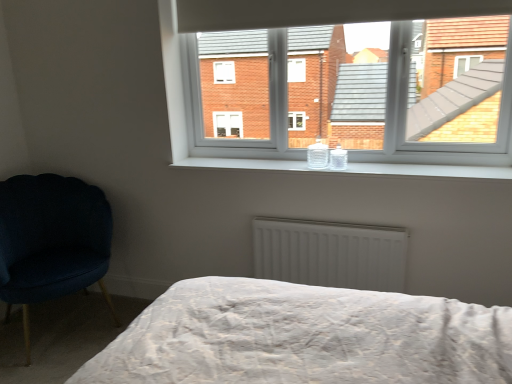
Question: Is white plastic window at upper center outside velvet dark blue chair at left?

Choices:
 (A) no
 (B) yes

Answer: (B)

Question: Is white plastic window at upper center shorter than velvet dark blue chair at left?

Choices:
 (A) yes
 (B) no

Answer: (A)

Question: Can you confirm if white plastic window at upper center is positioned to the left of velvet dark blue chair at left?

Choices:
 (A) no
 (B) yes

Answer: (A)

Question: Is velvet dark blue chair at left surrounded by white plastic window at upper center?

Choices:
 (A) no
 (B) yes

Answer: (A)

Question: Does white plastic window at upper center have a smaller size compared to velvet dark blue chair at left?

Choices:
 (A) no
 (B) yes

Answer: (B)

Question: Is white plastic window at upper center bigger than velvet dark blue chair at left?

Choices:
 (A) yes
 (B) no

Answer: (B)

Question: Is velvet dark blue chair at left shorter than white plastic window at upper center?

Choices:
 (A) yes
 (B) no

Answer: (B)

Question: Is velvet dark blue chair at left surrounding white plastic window at upper center?

Choices:
 (A) yes
 (B) no

Answer: (B)

Question: Is velvet dark blue chair at left facing towards white plastic window at upper center?

Choices:
 (A) yes
 (B) no

Answer: (B)

Question: Does velvet dark blue chair at left come in front of white plastic window at upper center?

Choices:
 (A) yes
 (B) no

Answer: (A)

Question: Does velvet dark blue chair at left have a lesser width compared to white plastic window at upper center?

Choices:
 (A) no
 (B) yes

Answer: (A)

Question: Considering the relative sizes of velvet dark blue chair at left and white plastic window at upper center in the image provided, is velvet dark blue chair at left taller than white plastic window at upper center?

Choices:
 (A) yes
 (B) no

Answer: (A)

Question: Is white plastic window at upper center located outside white matte radiator at center?

Choices:
 (A) no
 (B) yes

Answer: (B)